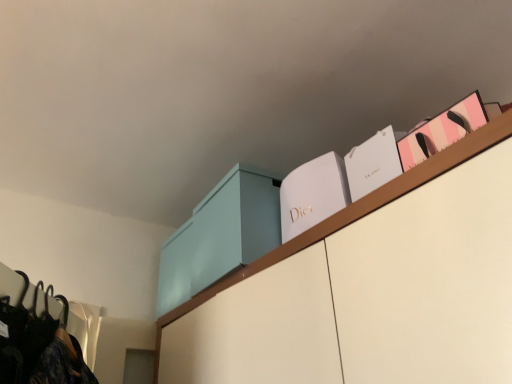
Question: Is light blue matte cabinet at upper center a part of white paper bag at upper right, the 2th book in the left-to-right sequence?

Choices:
 (A) no
 (B) yes

Answer: (A)

Question: Is white paper bag at upper right, marked as the 2th book in a right-to-left arrangement, bigger than light blue matte cabinet at upper center?

Choices:
 (A) yes
 (B) no

Answer: (B)

Question: Is white paper bag at upper right, the 2th book in the left-to-right sequence, completely or partially outside of light blue matte cabinet at upper center?

Choices:
 (A) yes
 (B) no

Answer: (A)

Question: From a real-world perspective, is white paper bag at upper right, the 2th book in the left-to-right sequence, located higher than light blue matte cabinet at upper center?

Choices:
 (A) yes
 (B) no

Answer: (B)

Question: Could you tell me if white paper bag at upper right, marked as the 2th book in a right-to-left arrangement, is facing light blue matte cabinet at upper center?

Choices:
 (A) yes
 (B) no

Answer: (B)

Question: From a real-world perspective, is light blue matte cabinet at upper center positioned above or below white paper bag at upper right, the 2th book in the left-to-right sequence?

Choices:
 (A) above
 (B) below

Answer: (A)

Question: Is light blue matte cabinet at upper center inside the boundaries of white paper bag at upper right, the 2th book in the left-to-right sequence, or outside?

Choices:
 (A) inside
 (B) outside

Answer: (B)

Question: Considering the positions of light blue matte cabinet at upper center and white paper bag at upper right, marked as the 2th book in a right-to-left arrangement, in the image, is light blue matte cabinet at upper center bigger or smaller than white paper bag at upper right, marked as the 2th book in a right-to-left arrangement,?

Choices:
 (A) big
 (B) small

Answer: (A)

Question: Is point (x=279, y=183) positioned closer to the camera than point (x=382, y=182)?

Choices:
 (A) farther
 (B) closer

Answer: (A)

Question: Based on their positions, is pink paper bag at upper right, the 1th book positioned from the right, located to the left or right of white paper bag at upper right, the 2th book in the left-to-right sequence?

Choices:
 (A) left
 (B) right

Answer: (B)

Question: Is pink paper bag at upper right, the 3th book from the left, inside the boundaries of white paper bag at upper right, marked as the 2th book in a right-to-left arrangement, or outside?

Choices:
 (A) outside
 (B) inside

Answer: (A)

Question: Is pink paper bag at upper right, the 1th book positioned from the right, taller or shorter than white paper bag at upper right, marked as the 2th book in a right-to-left arrangement?

Choices:
 (A) short
 (B) tall

Answer: (A)

Question: Is point (442, 137) closer or farther from the camera than point (381, 168)?

Choices:
 (A) closer
 (B) farther

Answer: (A)

Question: Considering the positions of white matte dior box at upper center, marked as the 3th book in a right-to-left arrangement, and light blue matte cabinet at upper center in the image, is white matte dior box at upper center, marked as the 3th book in a right-to-left arrangement, taller or shorter than light blue matte cabinet at upper center?

Choices:
 (A) short
 (B) tall

Answer: (A)

Question: Is white matte dior box at upper center, marked as the 3th book in a right-to-left arrangement, inside the boundaries of light blue matte cabinet at upper center, or outside?

Choices:
 (A) inside
 (B) outside

Answer: (B)